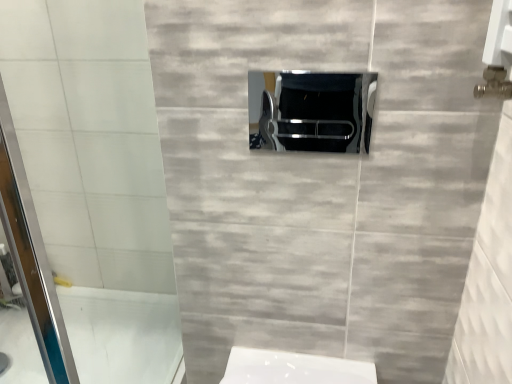
Describe the element at coordinates (494, 84) in the screenshot. I see `gold metallic faucet at upper right` at that location.

Locate an element on the screen. gold metallic faucet at upper right is located at coordinates (494, 84).

Where is `gold metallic faucet at upper right`? gold metallic faucet at upper right is located at coordinates (494, 84).